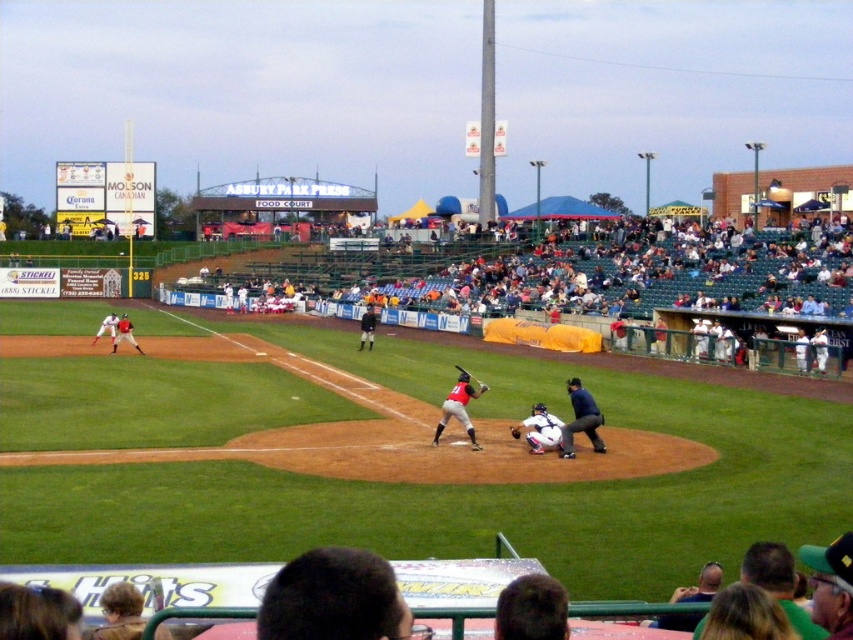
Question: Is brown leather glove at center bigger than dark brown leather glove at center?

Choices:
 (A) no
 (B) yes

Answer: (B)

Question: Which point is farther from the camera taking this photo?

Choices:
 (A) (97, 339)
 (B) (515, 426)

Answer: (A)

Question: Based on their relative distances, which object is nearer to the brown leather glove at center?

Choices:
 (A) white plastic seats at center
 (B) dark brown leather glove at center
 (C) matte red baseball bat at center

Answer: (B)

Question: Does matte red baseball glove at left have a smaller size compared to metallic bat at center?

Choices:
 (A) no
 (B) yes

Answer: (A)

Question: Is matte red baseball bat at center smaller than matte red baseball glove at left?

Choices:
 (A) no
 (B) yes

Answer: (B)

Question: Which object is closer to the camera taking this photo?

Choices:
 (A) blue fabric umpire at center
 (B) white plastic seats at center

Answer: (A)